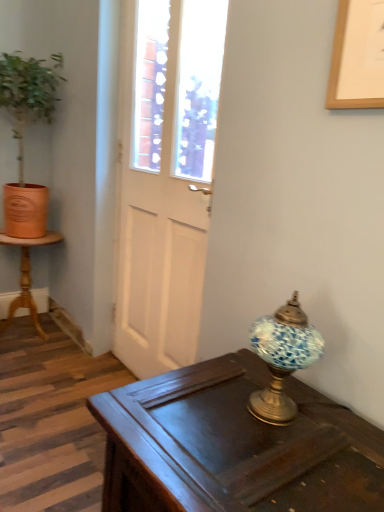
The width and height of the screenshot is (384, 512). Find the location of `vacant area situated below wooden pedestal table at left (from a real-world perspective)`. vacant area situated below wooden pedestal table at left (from a real-world perspective) is located at coordinates (29, 333).